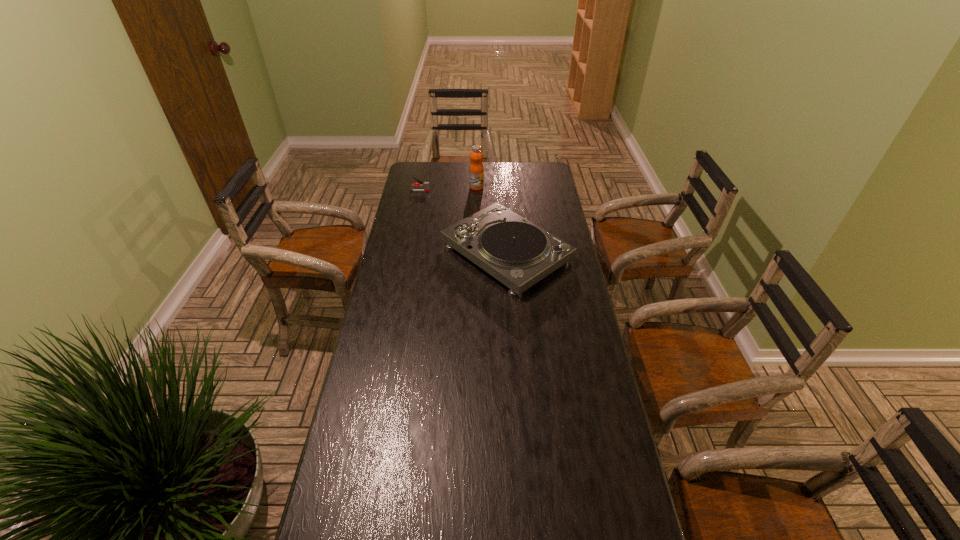
Where is `object that is at the right edge`? This screenshot has height=540, width=960. object that is at the right edge is located at coordinates (518, 253).

In the image, there is a desktop. Identify the location of vacant space at the far edge. Image resolution: width=960 pixels, height=540 pixels. (511, 161).

You are a GUI agent. You are given a task and a screenshot of the screen. Output one action in this format:
    pyautogui.click(x=<x>, y=<y>)
    Task: Click on the vacant region at the left edge of the desktop
    The image size is (960, 540).
    Given the screenshot: What is the action you would take?
    pyautogui.click(x=398, y=204)

At what (x,y) coordinates should I click in order to perform the action: click on vacant point located between the tallest object and the stapler. Please return your answer as a coordinate pair (x, y). Image resolution: width=960 pixels, height=540 pixels. Looking at the image, I should click on (448, 189).

I want to click on vacant area between the shortest object and the tallest object, so click(x=448, y=189).

Identify which object is the second closest to the stapler. Please provide its 2D coordinates. Your answer should be formatted as a tuple, i.e. [(x, y)], where the tuple contains the x and y coordinates of a point satisfying the conditions above.

[(518, 253)]

Point out which object is positioned as the second nearest to the nearest object. Please provide its 2D coordinates. Your answer should be formatted as a tuple, i.e. [(x, y)], where the tuple contains the x and y coordinates of a point satisfying the conditions above.

[(426, 185)]

This screenshot has width=960, height=540. I want to click on free space that satisfies the following two spatial constraints: 1. on the back side of the second tallest object; 2. on the handle side of the stapler, so click(x=502, y=191).

Identify the location of vacant area that satisfies the following two spatial constraints: 1. on the handle side of the record player; 2. on the right side of the leftmost object. pyautogui.click(x=408, y=253).